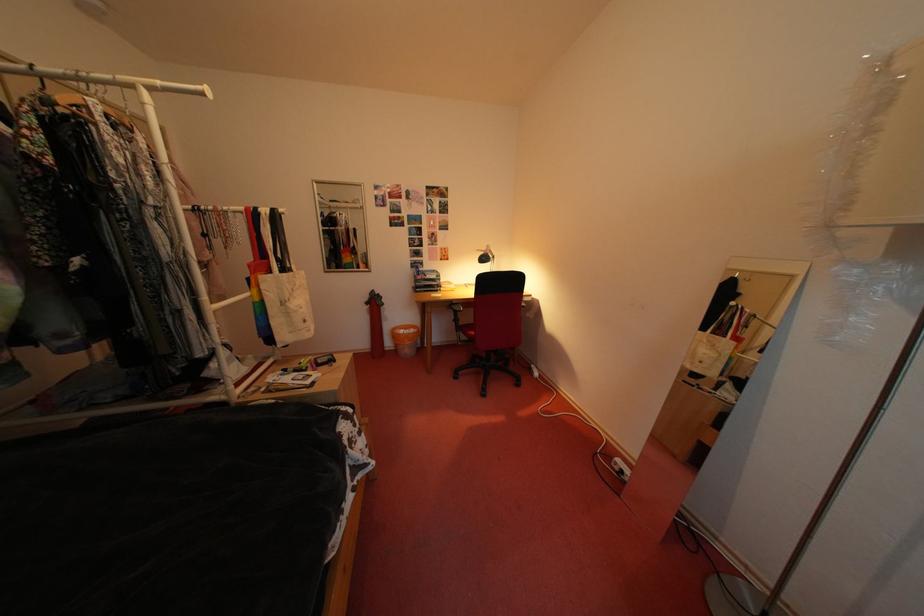
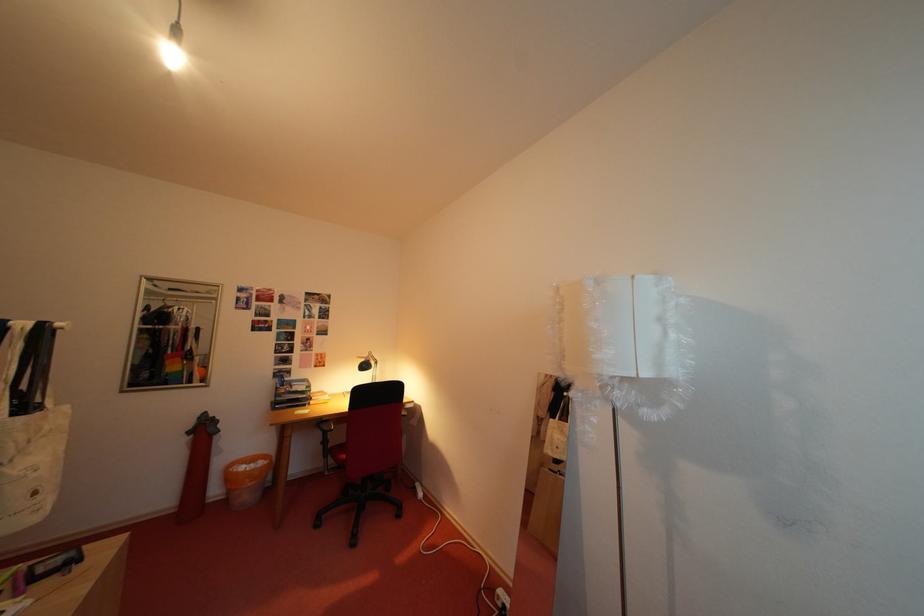
The images are taken continuously from a first-person perspective. In which direction is your viewpoint rotating?

The rotation direction of the camera is right-up.